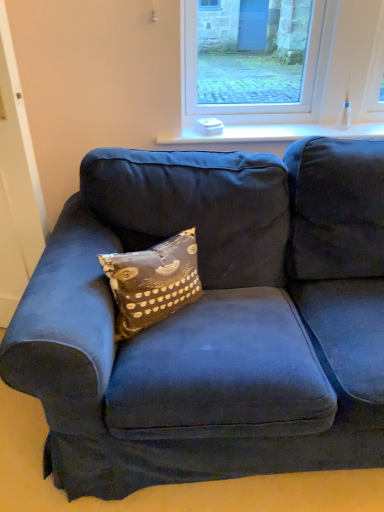
Question: Is brown printed cushion at center oriented away from clear glass window at upper center?

Choices:
 (A) no
 (B) yes

Answer: (A)

Question: Is brown printed cushion at center next to clear glass window at upper center?

Choices:
 (A) yes
 (B) no

Answer: (B)

Question: From a real-world perspective, does brown printed cushion at center stand above clear glass window at upper center?

Choices:
 (A) yes
 (B) no

Answer: (B)

Question: Is brown printed cushion at center aimed at clear glass window at upper center?

Choices:
 (A) no
 (B) yes

Answer: (A)

Question: Can you confirm if brown printed cushion at center is positioned to the left of clear glass window at upper center?

Choices:
 (A) yes
 (B) no

Answer: (A)

Question: Considering the relative sizes of brown printed cushion at center and clear glass window at upper center in the image provided, is brown printed cushion at center shorter than clear glass window at upper center?

Choices:
 (A) no
 (B) yes

Answer: (B)

Question: Can white glossy window sill at upper center be found inside clear glass window at upper center?

Choices:
 (A) yes
 (B) no

Answer: (B)

Question: Is clear glass window at upper center not inside white glossy window sill at upper center?

Choices:
 (A) no
 (B) yes

Answer: (B)

Question: Is clear glass window at upper center behind white glossy window sill at upper center?

Choices:
 (A) no
 (B) yes

Answer: (A)

Question: Can you confirm if clear glass window at upper center is wider than white glossy window sill at upper center?

Choices:
 (A) yes
 (B) no

Answer: (B)

Question: Can you confirm if clear glass window at upper center is shorter than white glossy window sill at upper center?

Choices:
 (A) no
 (B) yes

Answer: (A)

Question: Could you tell me if clear glass window at upper center is facing white glossy window sill at upper center?

Choices:
 (A) no
 (B) yes

Answer: (B)

Question: Would you say brown printed cushion at center is outside white glossy window sill at upper center?

Choices:
 (A) no
 (B) yes

Answer: (B)